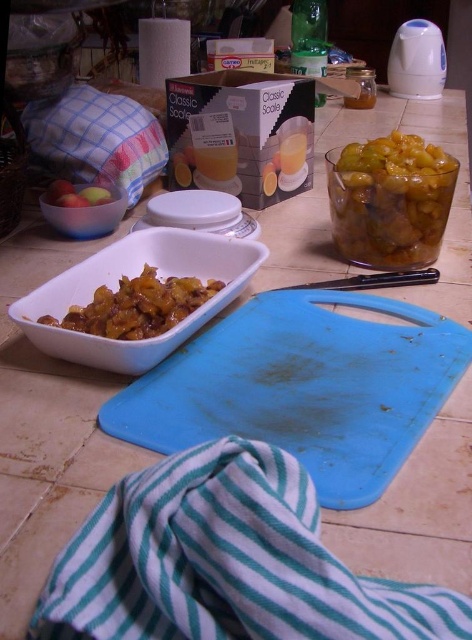
Question: Among these objects, which one is farthest from the camera?

Choices:
 (A) white glossy bowl at center-left
 (B) matte white bowl at left

Answer: (B)

Question: Can you confirm if matte white bowl at left is thinner than smooth glossy apple at center left?

Choices:
 (A) no
 (B) yes

Answer: (A)

Question: Which point appears closest to the camera in this image?

Choices:
 (A) (387, 156)
 (B) (224, 168)
 (C) (73, 221)
 (D) (305, 148)

Answer: (A)

Question: Does translucent glass jar at upper right have a lesser width compared to translucent plastic juice at center?

Choices:
 (A) no
 (B) yes

Answer: (A)

Question: Based on their relative distances, which object is nearer to the translucent plastic cup at center?

Choices:
 (A) translucent plastic juice at center
 (B) brown glossy food at center-left
 (C) translucent glass jar at upper right

Answer: (A)

Question: Does translucent plastic juice at center come behind translucent plastic cup at center?

Choices:
 (A) no
 (B) yes

Answer: (A)